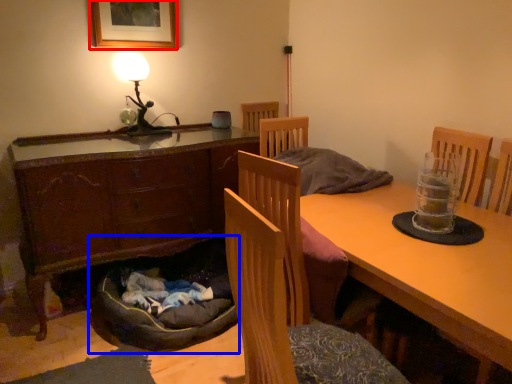
Question: Which of the following is the farthest to the observer, picture frame (highlighted by a red box) or dog bed (highlighted by a blue box)?

Choices:
 (A) picture frame
 (B) dog bed

Answer: (A)